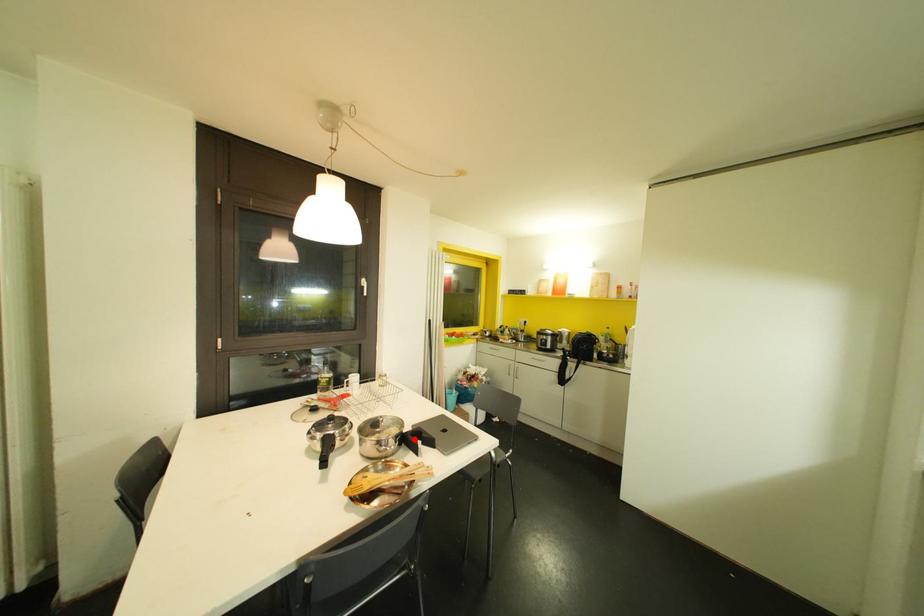
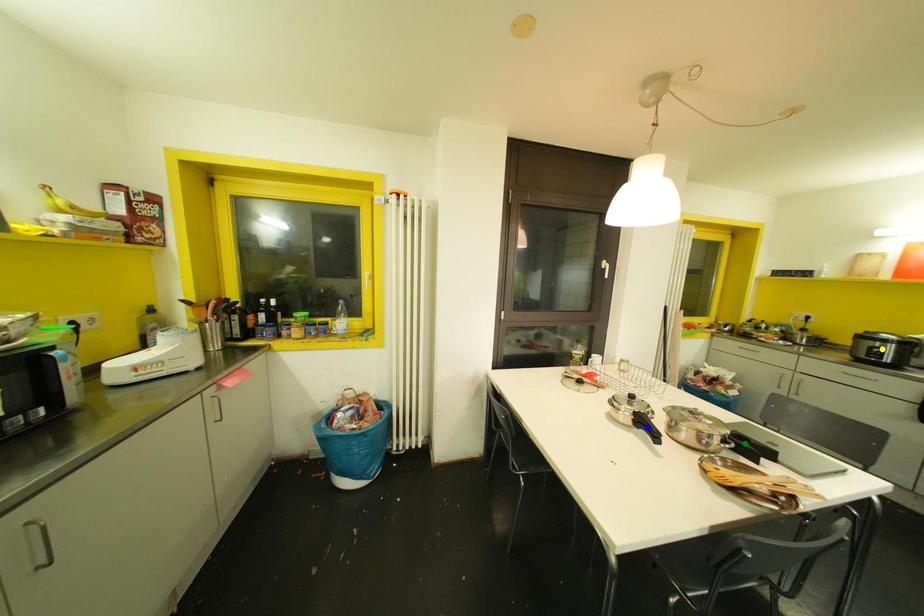
Question: I am providing you with two images of the same scene from different viewpoints. A red point is marked on the first image. You are given multiple points on the second image. Which mark in image 2 goes with the point in image 1?

Choices:
 (A) yellow point
 (B) green point
 (C) blue point

Answer: (B)